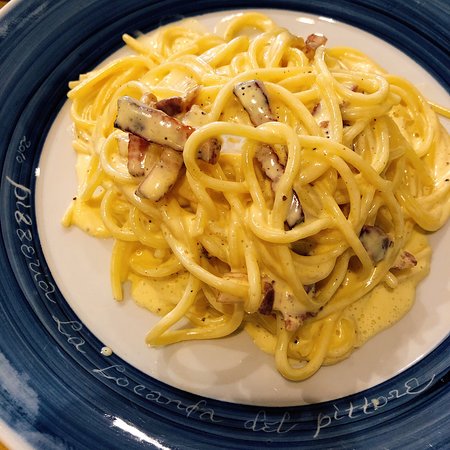
You are a GUI agent. You are given a task and a screenshot of the screen. Output one action in this format:
    pyautogui.click(x=<x>, y=<y>)
    Task: Click on the plate
    This screenshot has height=450, width=450.
    Given the screenshot: What is the action you would take?
    pyautogui.click(x=206, y=391)